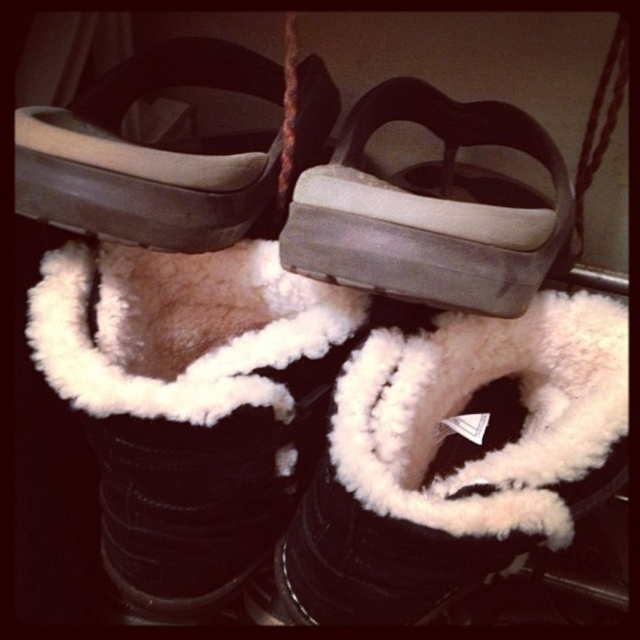
Does gray rubber sandal at center appear over matte gray sandal at upper center?

No, gray rubber sandal at center is not above matte gray sandal at upper center.

Is point (420, 221) in front of point (192, 65)?

Yes, it is.

Who is more forward, (394, 221) or (304, 131)?

Point (394, 221) is in front.

Locate an element on the screen. Image resolution: width=640 pixels, height=640 pixels. gray rubber sandal at center is located at coordinates (428, 211).

Can you confirm if white fluffy boot at center is smaller than matte gray sandal at upper center?

Indeed, white fluffy boot at center has a smaller size compared to matte gray sandal at upper center.

Which of these two, white fluffy boot at center or matte gray sandal at upper center, stands taller?

Standing taller between the two is white fluffy boot at center.

Who is more forward, (465, 568) or (108, 88)?

Point (465, 568) is in front.

The image size is (640, 640). I want to click on white fluffy boot at center, so coord(460,458).

Between white fluffy boot at center and gray rubber sandal at center, which one appears on the right side from the viewer's perspective?

From the viewer's perspective, gray rubber sandal at center appears more on the right side.

Does white fluffy boot at center appear on the left side of gray rubber sandal at center?

Yes, white fluffy boot at center is to the left of gray rubber sandal at center.

Locate an element on the screen. This screenshot has height=640, width=640. white fluffy boot at center is located at coordinates (460, 458).